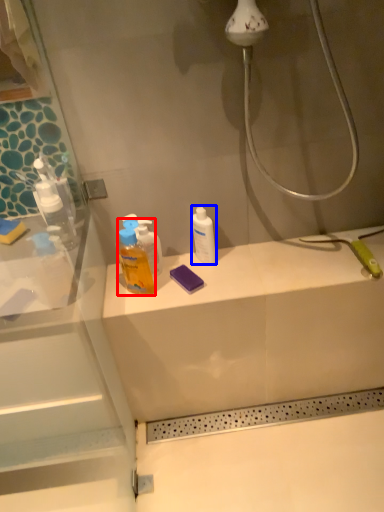
Question: Which object appears closest to the camera in this image, cleaning product (highlighted by a red box) or mouthwash (highlighted by a blue box)?

Choices:
 (A) cleaning product
 (B) mouthwash

Answer: (A)